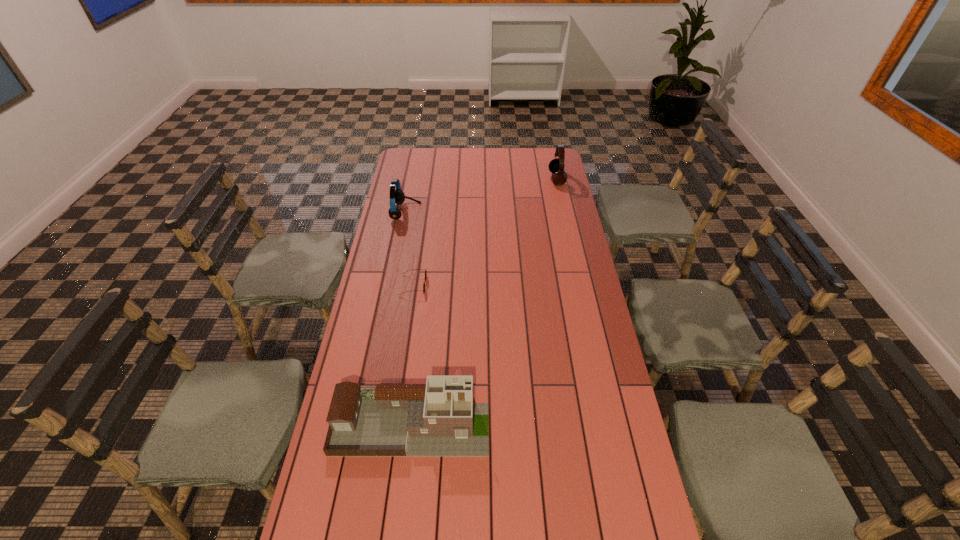
The image size is (960, 540). In order to click on the right headset in this screenshot , I will do `click(556, 166)`.

I want to click on the farthest object, so click(556, 166).

In order to click on the left headset in this screenshot , I will do `click(397, 196)`.

Find the location of `the third nearest object`. the third nearest object is located at coordinates (397, 196).

Image resolution: width=960 pixels, height=540 pixels. I want to click on the nearest object, so click(438, 419).

Where is `the second nearest object`? The image size is (960, 540). the second nearest object is located at coordinates (425, 269).

Find the location of a particular element. The image size is (960, 540). the shortest object is located at coordinates (425, 269).

Locate an element on the screen. vacant position located 0.130m on the ear pads of the farther headset is located at coordinates (523, 179).

Locate an element on the screen. free spot located on the ear pads of the farther headset is located at coordinates (497, 179).

This screenshot has width=960, height=540. Find the location of `free space located 0.260m on the ear pads of the farther headset`. free space located 0.260m on the ear pads of the farther headset is located at coordinates (497, 179).